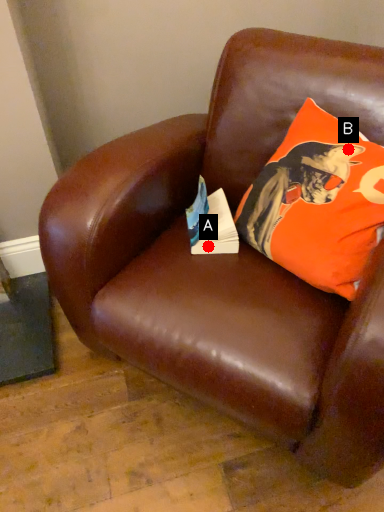
Question: Two points are circled on the image, labeled by A and B beside each circle. Which point is closer to the camera?

Choices:
 (A) A is closer
 (B) B is closer

Answer: (B)